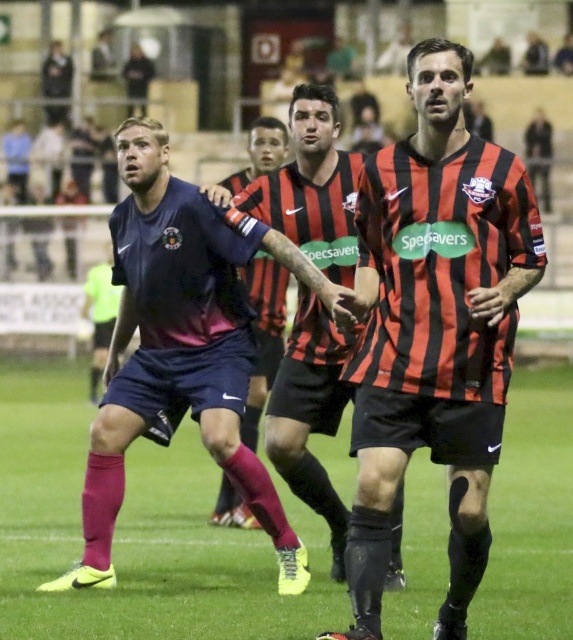
Question: Among these points, which one is nearest to the camera?

Choices:
 (A) (363, 451)
 (B) (269, 355)

Answer: (A)

Question: Which of these objects is positioned farthest from the green grass at center?

Choices:
 (A) red and black striped jersey at center
 (B) matte black shorts at center
 (C) dark blue jersey at left

Answer: (B)

Question: Which point is closer to the camera taking this photo?

Choices:
 (A) (201, 557)
 (B) (222, 180)

Answer: (A)

Question: Is dark blue jersey at left positioned before matte black shorts at center?

Choices:
 (A) no
 (B) yes

Answer: (B)

Question: Can you confirm if red and black striped jersey at center is positioned below dark blue jersey at left?

Choices:
 (A) yes
 (B) no

Answer: (B)

Question: Does dark blue jersey at left have a larger size compared to matte black shorts at center?

Choices:
 (A) no
 (B) yes

Answer: (B)